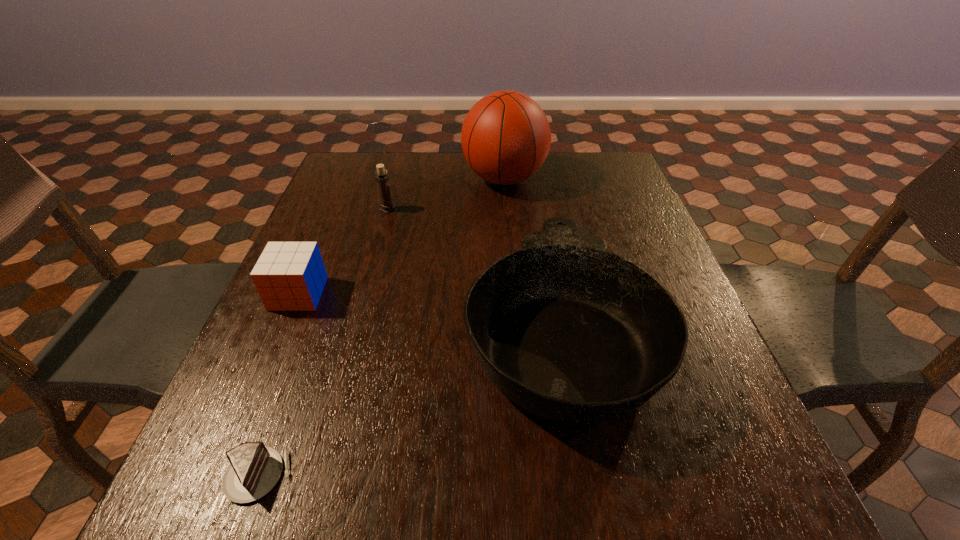
Locate an element on the screen. This screenshot has width=960, height=540. free space between the shortest object and the farthest object is located at coordinates (381, 327).

Find the location of a particular element. free space between the tallest object and the third object from right to left is located at coordinates (445, 194).

Locate an element on the screen. The width and height of the screenshot is (960, 540). vacant point located between the fourth tallest object and the chocolate cake is located at coordinates (278, 384).

Locate an element on the screen. empty location between the farthest object and the third object from right to left is located at coordinates (445, 194).

You are a GUI agent. You are given a task and a screenshot of the screen. Output one action in this format:
    pyautogui.click(x=<x>, y=<y>)
    Task: Click on the free space between the farthest object and the shortest object
    The width and height of the screenshot is (960, 540).
    Given the screenshot: What is the action you would take?
    pyautogui.click(x=381, y=327)

Find the location of a particular element. The image size is (960, 540). vacant point located between the fourth tallest object and the second farthest object is located at coordinates (343, 252).

The image size is (960, 540). Identify the location of vacant area between the third object from left to right and the basketball. (445, 194).

This screenshot has width=960, height=540. In order to click on the second closest object relative to the chocolate cake in this screenshot , I will do `click(289, 276)`.

Where is `object that is the second closest to the candle holder`? This screenshot has height=540, width=960. object that is the second closest to the candle holder is located at coordinates (568, 331).

This screenshot has height=540, width=960. Identify the location of free region that satisfies the following two spatial constraints: 1. on the back side of the chocolate cake; 2. on the right side of the basketball. (366, 179).